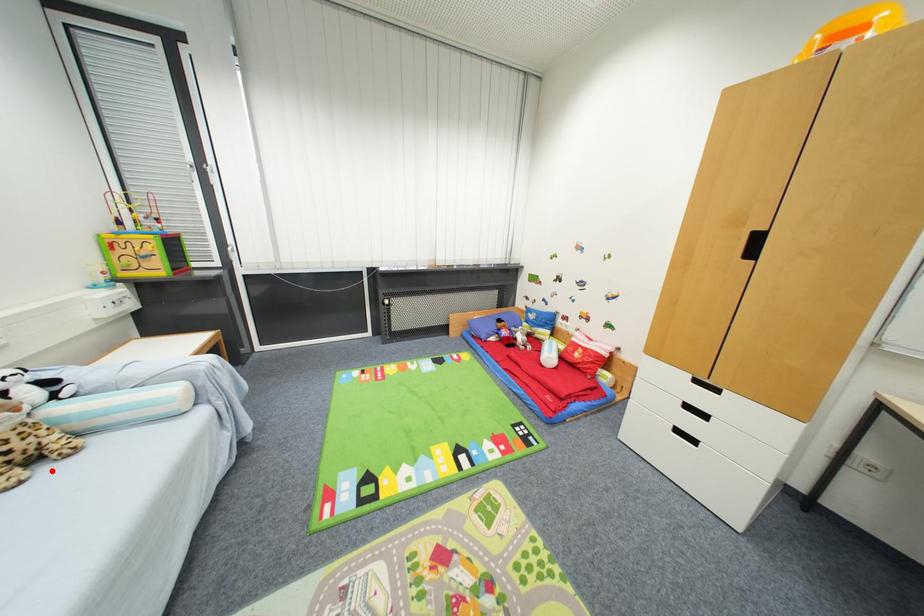
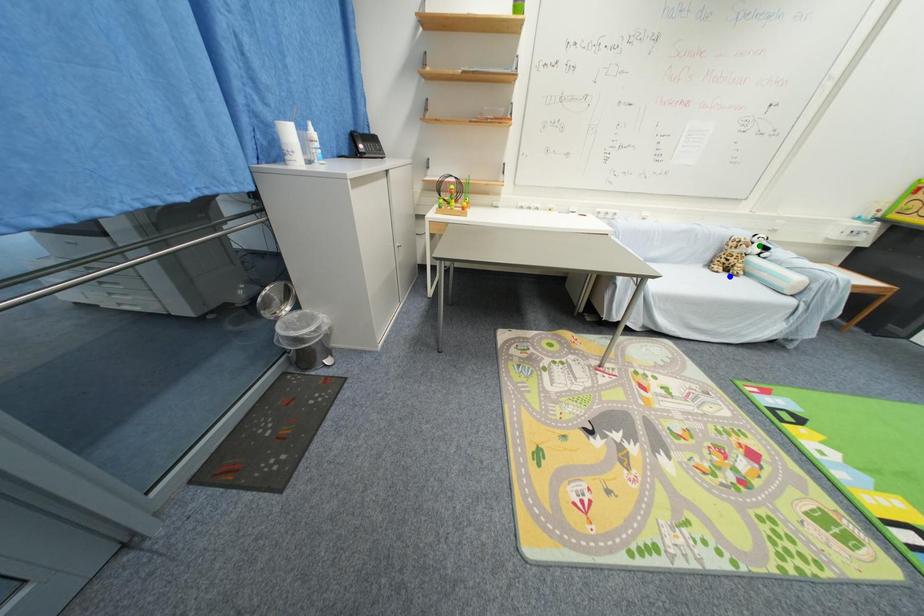
Question: I am providing you with two images of the same scene from different viewpoints. A red point is marked on the first image. You are given multiple points on the second image. Which point in image 2 is actually the same real-world point as the red point in image 1?

Choices:
 (A) yellow point
 (B) green point
 (C) blue point

Answer: (C)